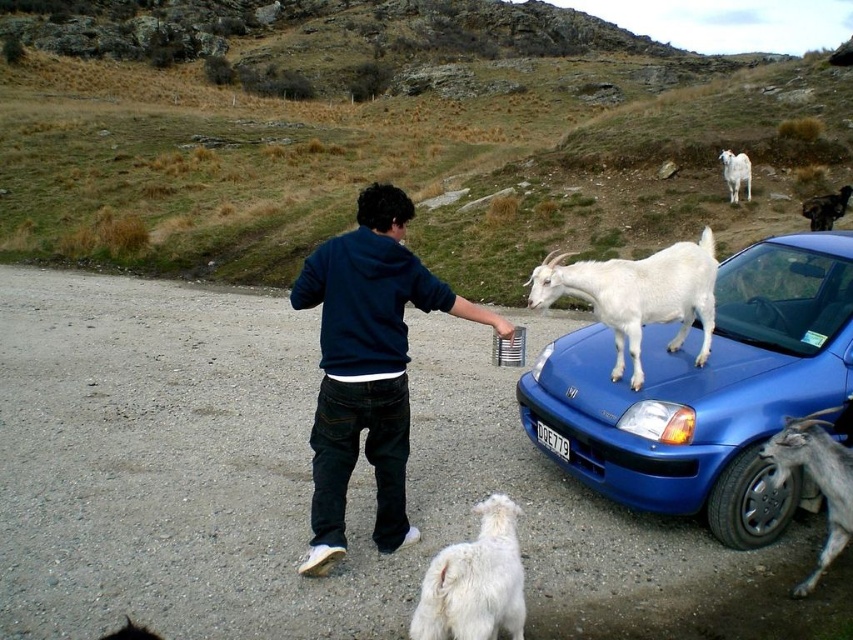
Question: Which object is farther from the camera taking this photo?

Choices:
 (A) black fur dog at upper right
 (B) white woolen goat at lower right

Answer: (A)

Question: Which object is positioned closest to the black fur dog at upper right?

Choices:
 (A) white woolen goat at upper right
 (B) blue glossy car at upper center
 (C) black plastic license plate at center
 (D) white fluffy goat at lower center

Answer: (A)

Question: Is white woolen goat at lower right to the right of black plastic license plate at center from the viewer's perspective?

Choices:
 (A) no
 (B) yes

Answer: (B)

Question: Estimate the real-world distances between objects in this image. Which object is farther from the blue glossy car at upper center?

Choices:
 (A) white fluffy goat at lower center
 (B) white woolen goat at upper right
 (C) black fur dog at upper right
 (D) dark blue hoodie at center

Answer: (B)

Question: Where is blue glossy car at upper center located in relation to white woolen goat at center in the image?

Choices:
 (A) left
 (B) right

Answer: (B)

Question: Does white woolen goat at center lie behind white fluffy goat at lower center?

Choices:
 (A) no
 (B) yes

Answer: (B)